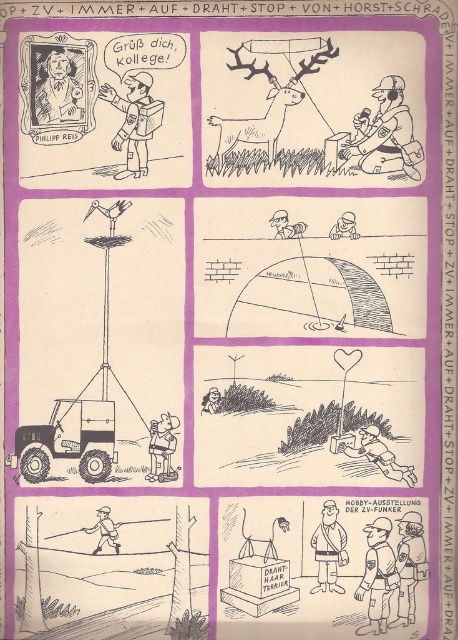
Looking at this image, which is below, metallic helmet at lower center or smooth plastic helmet at upper center?

metallic helmet at lower center is lower down.

Is point (363, 432) more distant than point (352, 230)?

Yes.

Who is more forward, (349, 436) or (339, 230)?

Point (339, 230) is in front.

The image size is (458, 640). What are the coordinates of `metallic helmet at lower center` in the screenshot? It's located at (372, 452).

Which is below, brown textured reindeer at upper center or matte black helmet at upper right?

matte black helmet at upper right

Can you confirm if brown textured reindeer at upper center is taller than matte black helmet at upper right?

Yes, brown textured reindeer at upper center is taller than matte black helmet at upper right.

Is point (272, 76) positioned behind point (367, 154)?

That is False.

Image resolution: width=458 pixels, height=640 pixels. I want to click on brown textured reindeer at upper center, so click(267, 96).

Is uniformed person at lower right further to camera compared to light brown uniform at center?

No, it is not.

Can you confirm if uniformed person at lower right is bigger than light brown uniform at center?

Correct, uniformed person at lower right is larger in size than light brown uniform at center.

This screenshot has width=458, height=640. Find the location of `uniformed person at lower right`. uniformed person at lower right is located at coordinates (377, 576).